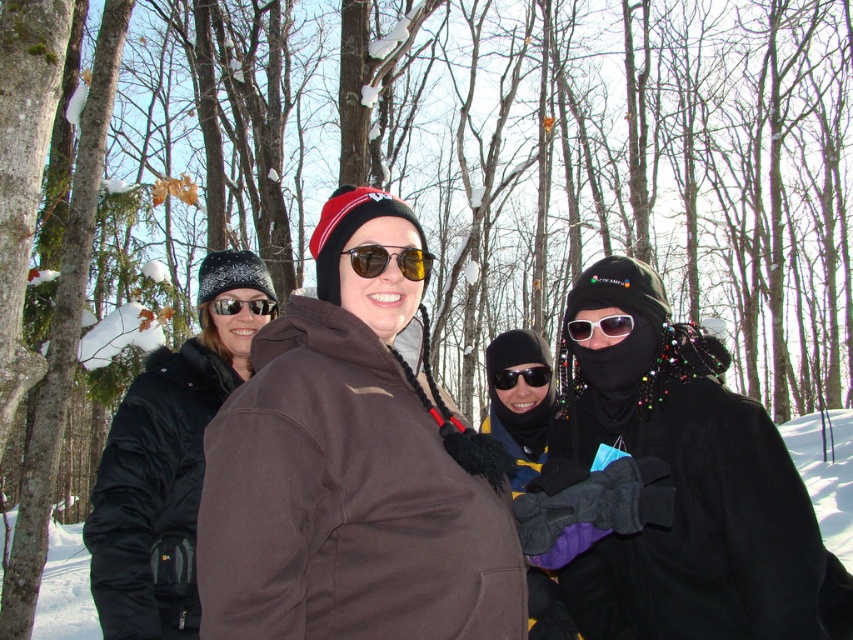
Question: Estimate the real-world distances between objects in this image. Which object is farther from the matte black sunglasses at center?

Choices:
 (A) brown fleece jacket at center
 (B) black reflective sunglasses at center

Answer: (A)

Question: Does black matte jacket at center have a lesser width compared to matte black sunglasses at center?

Choices:
 (A) yes
 (B) no

Answer: (B)

Question: Which point is farther to the camera?

Choices:
 (A) black matte jacket at center
 (B) yellow reflective sunglasses at center
 (C) brown fleece jacket at center

Answer: (A)

Question: Which is farther from the black fuzzy jacket at left?

Choices:
 (A) brown fleece jacket at center
 (B) black matte jacket at center
 (C) yellow reflective sunglasses at center

Answer: (B)

Question: Observing the image, what is the correct spatial positioning of black matte jacket at center in reference to yellow reflective sunglasses at center?

Choices:
 (A) left
 (B) right

Answer: (B)

Question: Can you confirm if yellow reflective sunglasses at center is positioned to the left of matte black sunglasses at center?

Choices:
 (A) no
 (B) yes

Answer: (A)